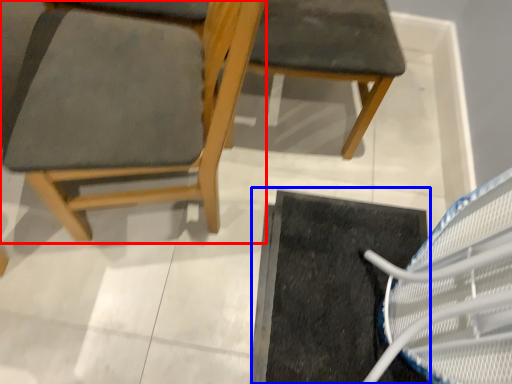
Question: Which of the following is the closest to the observer, chair (highlighted by a red box) or doormat (highlighted by a blue box)?

Choices:
 (A) chair
 (B) doormat

Answer: (A)